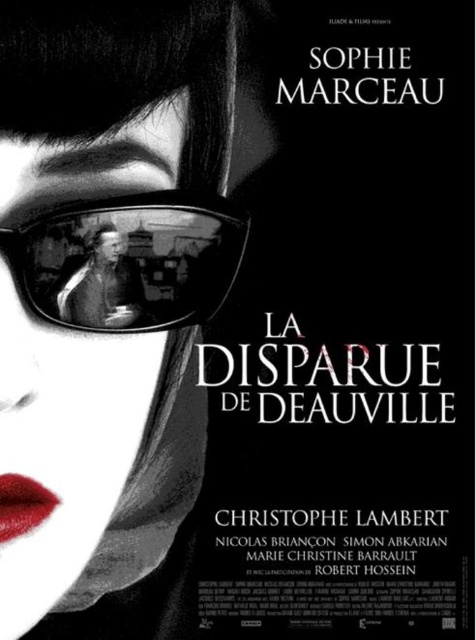
You are a photographer analyzing the movie poster for La Disparue de Deauville. You notice two points marked on the poster at coordinates point (72, 289) and point (18, 529). Which of these points is closer to the viewer?

Point (72, 289) is closer to the camera than point (18, 529).

Based on the movie poster for La Disparue de Deauville, which of the two points, point [47,214] or point [19,515], is closer to the viewer?

Point [47,214] is in front of point [19,515], so it is closer to the viewer.